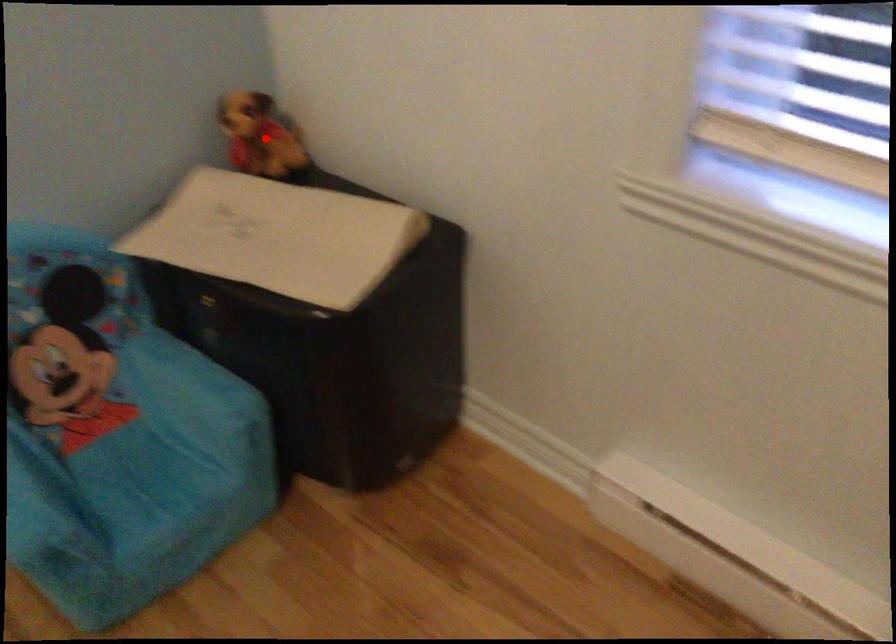
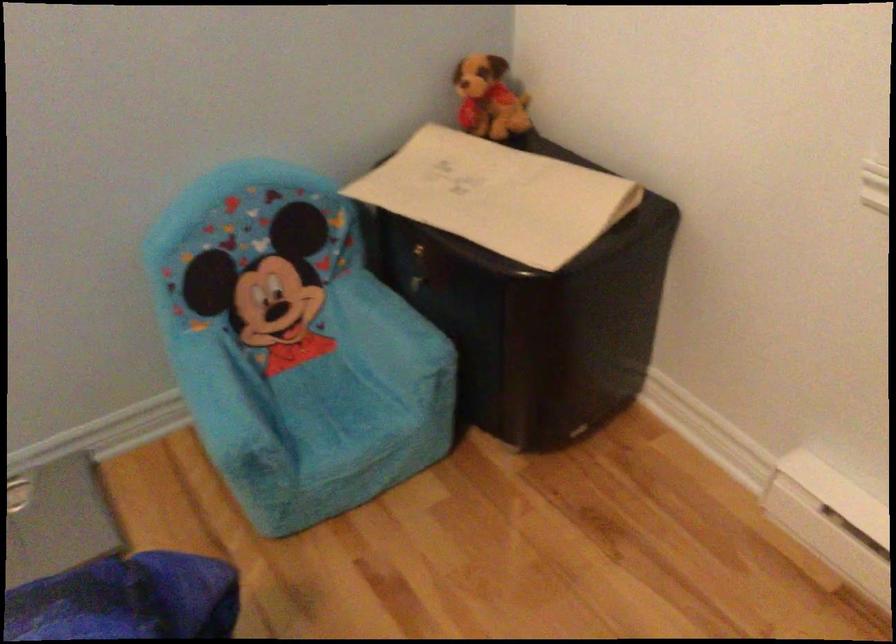
The point at the highlighted location is marked in the first image. Where is the corresponding point in the second image?

(488, 99)